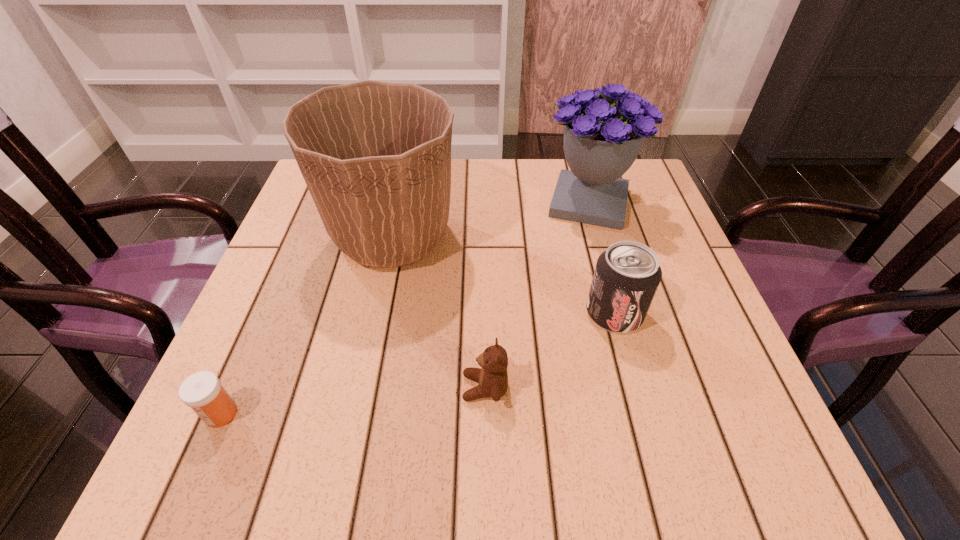
The image size is (960, 540). What are the coordinates of `vacant region at the near right corner of the desktop` in the screenshot? It's located at (666, 419).

Locate an element on the screen. This screenshot has width=960, height=540. vacant space in between the shortest object and the fourth object from right to left is located at coordinates (306, 325).

Where is `vacant space in between the third nearest object and the third object from right to left`? vacant space in between the third nearest object and the third object from right to left is located at coordinates (549, 350).

Where is `blank region between the soda can and the shortest object`? This screenshot has height=540, width=960. blank region between the soda can and the shortest object is located at coordinates (418, 363).

I want to click on vacant area between the flowerpot and the leftmost object, so click(306, 325).

Identify the location of empty space between the bouquet and the second object from left to right. click(x=491, y=220).

This screenshot has height=540, width=960. Find the location of `free space between the teddy bear and the soda can`. free space between the teddy bear and the soda can is located at coordinates (549, 350).

Where is `free space between the leftmost object and the fourth object from right to left`? This screenshot has height=540, width=960. free space between the leftmost object and the fourth object from right to left is located at coordinates (306, 325).

Locate an element on the screen. The width and height of the screenshot is (960, 540). free space between the soda can and the third object from right to left is located at coordinates (549, 350).

What are the coordinates of `object that stands as the fourth closest to the fourth object from right to left` in the screenshot? It's located at (202, 391).